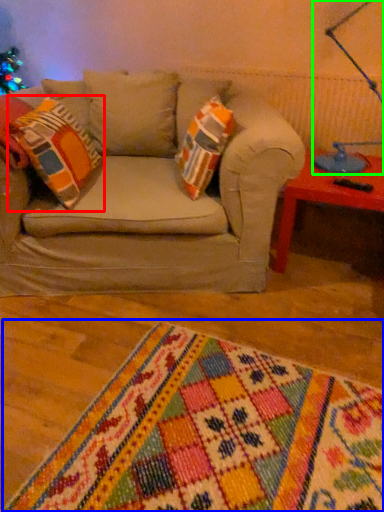
Question: Which object is the closest to the throw pillow (highlighted by a red box)? Choose among these: blanket (highlighted by a blue box) or table lamp (highlighted by a green box).

Choices:
 (A) blanket
 (B) table lamp

Answer: (A)